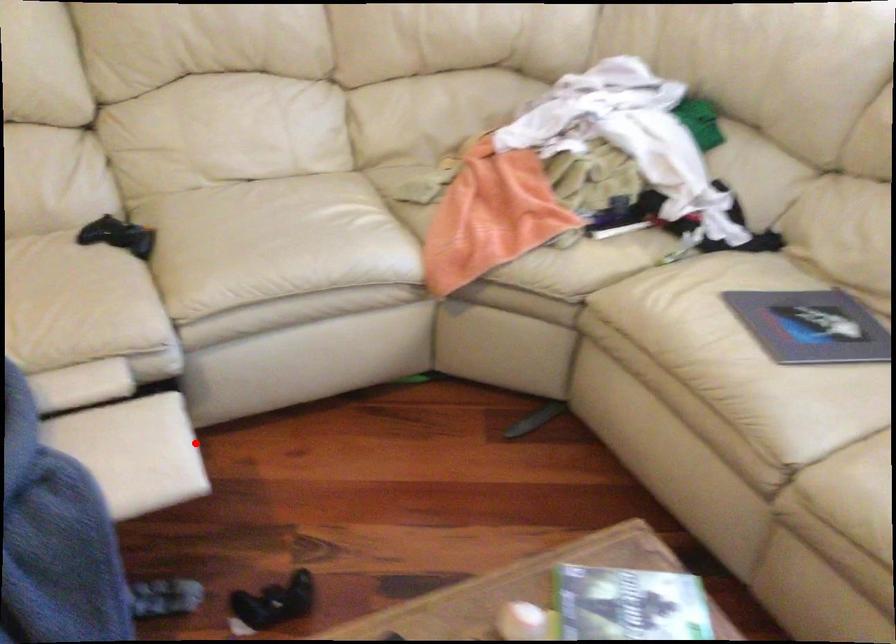
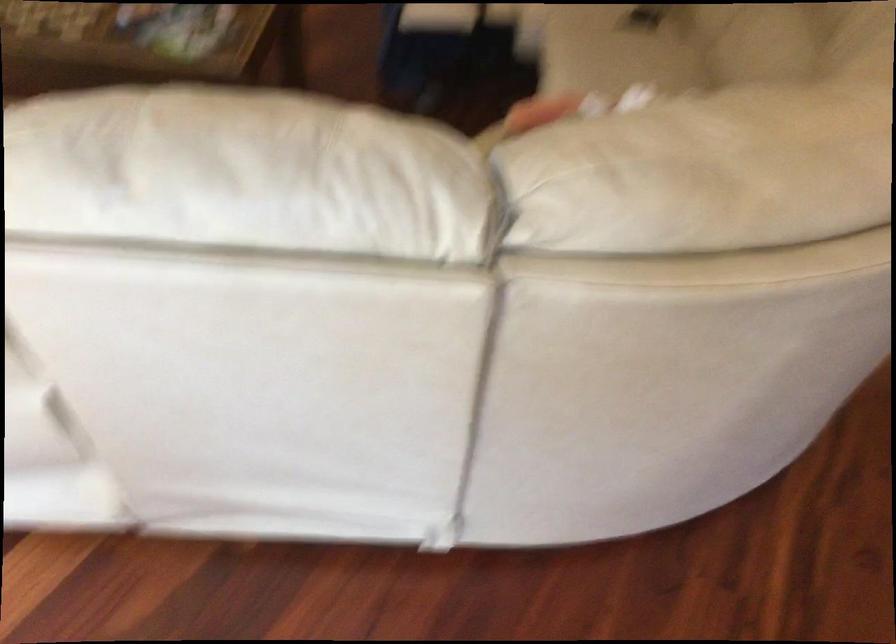
Question: A red point is marked in image1. In image2, is the corresponding 3D point closer to the camera or farther? Reply with the corresponding letter.

Choices:
 (A) The corresponding 3D point is closer.
 (B) The corresponding 3D point is farther.

Answer: (B)